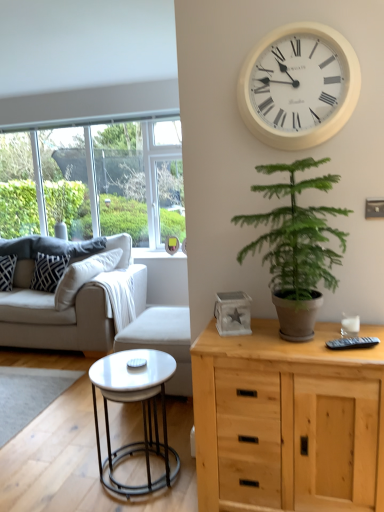
Question: Considering the relative sizes of white fabric armchair at center and patterned fabric pillow at left, placed as the 1th pillow when sorted from left to right, in the image provided, is white fabric armchair at center taller than patterned fabric pillow at left, placed as the 1th pillow when sorted from left to right,?

Choices:
 (A) yes
 (B) no

Answer: (A)

Question: Is white fabric armchair at center shorter than patterned fabric pillow at left, the 2th pillow from the right?

Choices:
 (A) no
 (B) yes

Answer: (A)

Question: Does white fabric armchair at center have a smaller size compared to patterned fabric pillow at left, placed as the 1th pillow when sorted from left to right?

Choices:
 (A) no
 (B) yes

Answer: (A)

Question: Considering the relative sizes of white fabric armchair at center and patterned fabric pillow at left, placed as the 1th pillow when sorted from left to right, in the image provided, is white fabric armchair at center wider than patterned fabric pillow at left, placed as the 1th pillow when sorted from left to right,?

Choices:
 (A) yes
 (B) no

Answer: (A)

Question: From the image's perspective, is white fabric armchair at center below patterned fabric pillow at left, placed as the 1th pillow when sorted from left to right?

Choices:
 (A) yes
 (B) no

Answer: (A)

Question: Would you say white fabric armchair at center is to the left or to the right of green leafy plant at center-right in the picture?

Choices:
 (A) left
 (B) right

Answer: (A)

Question: Considering the positions of white fabric armchair at center and green leafy plant at center-right in the image, is white fabric armchair at center wider or thinner than green leafy plant at center-right?

Choices:
 (A) wide
 (B) thin

Answer: (A)

Question: In the image, is white fabric armchair at center positioned in front of or behind green leafy plant at center-right?

Choices:
 (A) front
 (B) behind

Answer: (B)

Question: Is white fabric armchair at center bigger or smaller than green leafy plant at center-right?

Choices:
 (A) small
 (B) big

Answer: (B)

Question: Choose the correct answer: Is natural wood cabinet at right inside white fabric armchair at center or outside it?

Choices:
 (A) inside
 (B) outside

Answer: (B)

Question: Is natural wood cabinet at right wider or thinner than white fabric armchair at center?

Choices:
 (A) thin
 (B) wide

Answer: (A)

Question: Considering the positions of point click(248, 388) and point click(180, 384), is point click(248, 388) closer or farther from the camera than point click(180, 384)?

Choices:
 (A) closer
 (B) farther

Answer: (A)

Question: From their relative heights in the image, would you say natural wood cabinet at right is taller or shorter than white fabric armchair at center?

Choices:
 (A) short
 (B) tall

Answer: (B)

Question: From a real-world perspective, is white plastic wall clock at upper center above or below natural wood cabinet at right?

Choices:
 (A) below
 (B) above

Answer: (B)

Question: Is point (251, 116) positioned closer to the camera than point (334, 334)?

Choices:
 (A) closer
 (B) farther

Answer: (A)